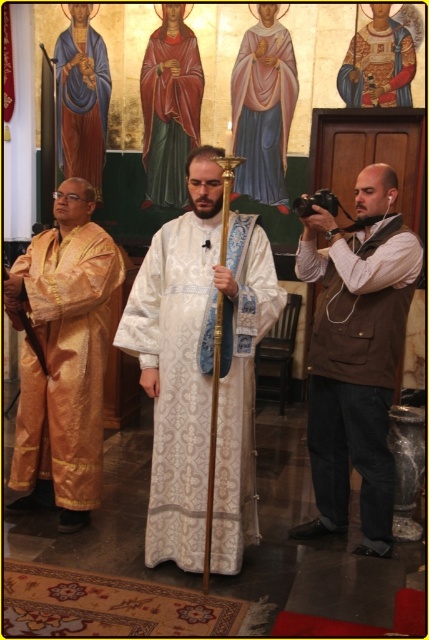
In the scene shown: You are standing in the church and want to take a photo of the central figure wearing a white robe with intricate patterns and a blue sash. The camera you have can focus on objects up to 10 feet away. Is the point at (x=213, y=252) within the camera focus range?

The point at (x=213, y=252) is 9.47 feet from the camera, which is within the camera focus range of up to 10 feet. Therefore, the camera can focus on this point to capture the central figure.

You are an interior designer planning to add a new tapestry to this sacred space. You have two robes available for inspiration, the gold silk robe at left and the matte gold robe at center. Which robe should you choose if you want the tapestry to have a design that is taller than the existing robes in the scene?

The gold silk robe at left has a lesser height compared to the matte gold robe at center. Therefore, to create a taller design, the tapestry should be based on the matte gold robe at center since it is taller than the gold silk robe at left.

You are a visitor standing at the entrance of the church. You want to walk from the gold silk robe at left to the gold brocade robe at upper center. Is the path between them wide enough for you to walk through comfortably?

The path between the gold silk robe at left and the gold brocade robe at upper center is 3.30 meters wide, which is more than sufficient for a person to walk through comfortably.